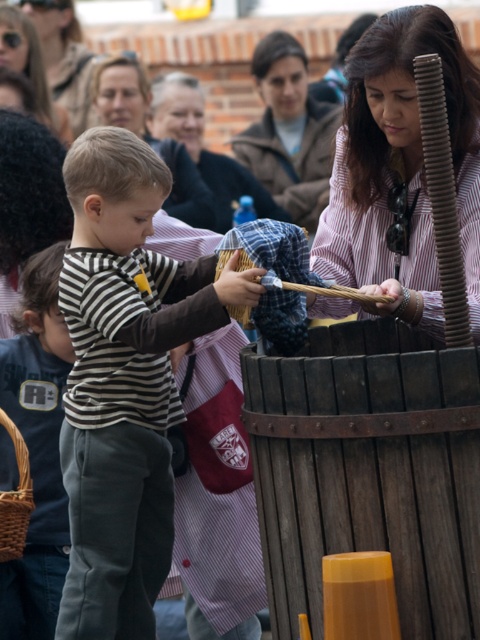
You are a photographer trying to capture a candid shot of the dark blue cotton shirt at left and the matte pink shirt at upper center. Since you want to ensure both subjects are in focus, you need to know their relative sizes. Which of the two shirts is smaller?

The dark blue cotton shirt at left has a smaller size compared to the matte pink shirt at upper center, so the dark blue cotton shirt at left is smaller.

You are standing in front of the barrel and want to place a small flag at two specific points on the barrel. The first point is at coordinates point (12, 321) and the second point is at point (135, 99). Which point will require you to reach further back to place the flag?

Point (135, 99) will require reaching further back because it is farther from the viewer compared to point (12, 321).